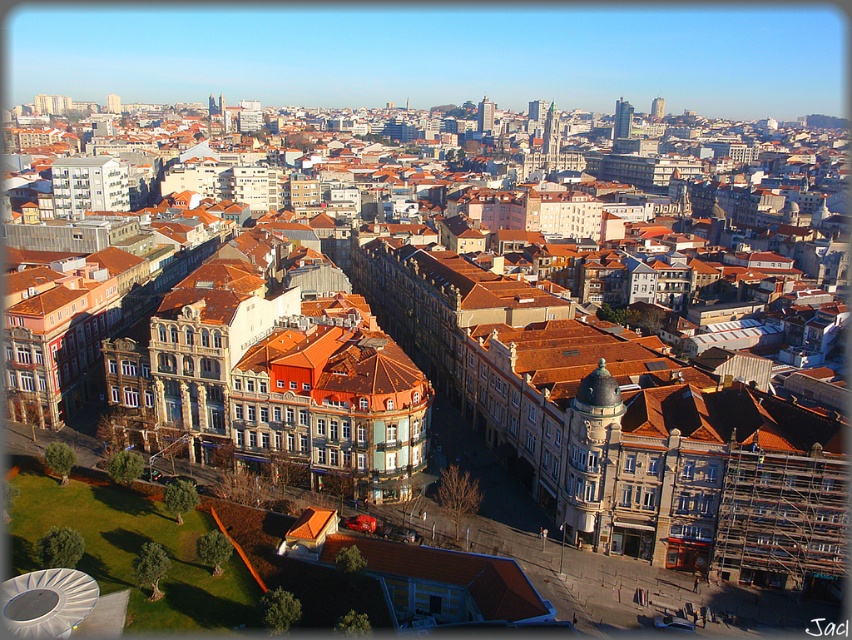
In the scene shown: Who is taller, matte copper dome at center or smooth gray tower at center?

Standing taller between the two is smooth gray tower at center.

Does matte copper dome at center have a greater height compared to smooth gray tower at center?

No.

Identify the location of matte copper dome at center. The image size is (852, 640). (591, 458).

Can you confirm if matte copper dome at center is positioned to the right of smooth glass skyscraper at upper center?

In fact, matte copper dome at center is to the left of smooth glass skyscraper at upper center.

Is matte copper dome at center bigger than smooth glass skyscraper at upper center?

No.

This screenshot has height=640, width=852. I want to click on matte copper dome at center, so click(591, 458).

Can you confirm if matte copper dome at center is positioned to the left of green stone tower at center?

Indeed, matte copper dome at center is positioned on the left side of green stone tower at center.

Can you confirm if matte copper dome at center is thinner than green stone tower at center?

Yes, matte copper dome at center is thinner than green stone tower at center.

Is point (580, 397) behind point (557, 144)?

No.

Find the location of a particular element. matte copper dome at center is located at coordinates (591, 458).